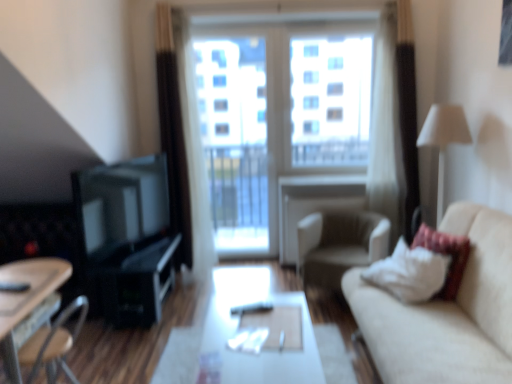
What are the coordinates of `free location in front of transparent glass screen door at center` in the screenshot? It's located at (234, 270).